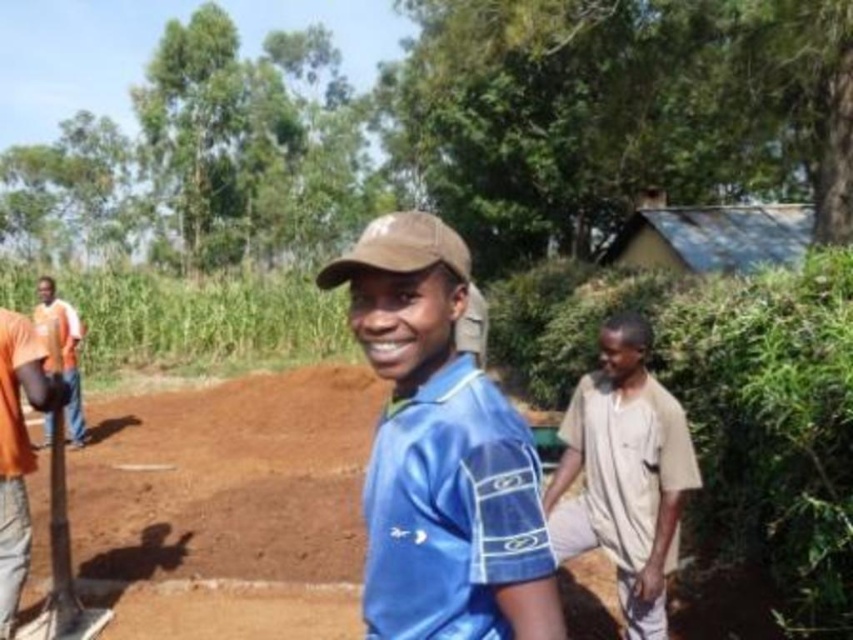
You are observing the scene from a distance. You notice two people wearing shirts of different colors. The blue fabric shirt at center and the orange fabric shirt at left. Which shirt is closer to you?

The blue fabric shirt at center is closer to you because it is shorter than the orange fabric shirt at left.

You are standing at the dirt path and want to take a photo of both the blue fabric shirt at center and the orange fabric shirt at left. Which one should you adjust your camera angle to look up at to include both in the frame?

You should adjust your camera angle to look up at the orange fabric shirt at left since the blue fabric shirt at center is located below it, allowing both to be captured in the frame.

You are standing at the origin point in the image and want to move towards the light beige cotton shirt at right. Which direction should you head in?

The light beige cotton shirt at right is located at point 0.741 on the x and 0.733 on the y, so you should move towards the upper right direction from your current position.